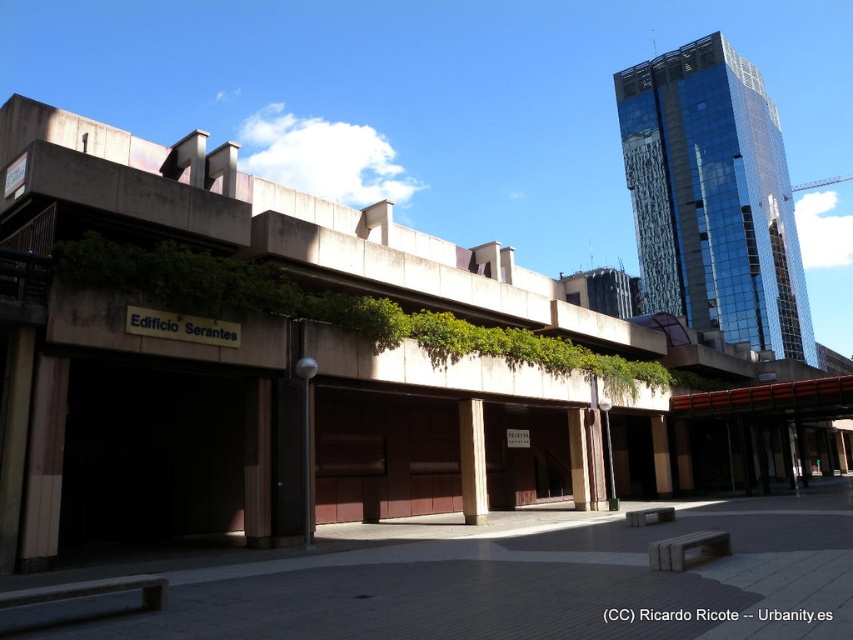
You are standing at the entrance of Edificio Serantes and want to walk towards the point marked at coordinates point (480, 401) and point (587, 461). Which point should you head towards first to reach them in the correct spatial order?

You should head towards point (480, 401) first because it is in front of point (587, 461), so reaching it first maintains the correct spatial sequence.

You are an architect evaluating the structural integrity of the pillars in the scene. Which pillar has a greater width between the smooth concrete pillar at center and the brown wood pillar at center?

The smooth concrete pillar at center has a greater width than the brown wood pillar at center according to the description provided.

You are standing in front of the Edificio Serantes and want to place a decorative statue between the smooth concrete pillar at center and the brown wood pillar at center. Which pillar should the statue be closer to if you want it to be closer to the left side of the building?

The statue should be placed closer to the smooth concrete pillar at center because it is positioned on the left side of the brown wood pillar at center, making it the closer option to the left side of the building.